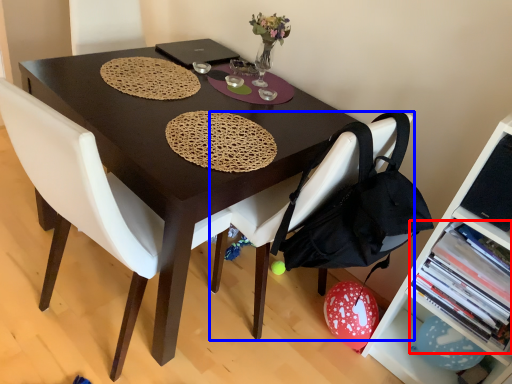
Question: Among these objects, which one is farthest to the camera, book (highlighted by a red box) or chair (highlighted by a blue box)?

Choices:
 (A) book
 (B) chair

Answer: (A)